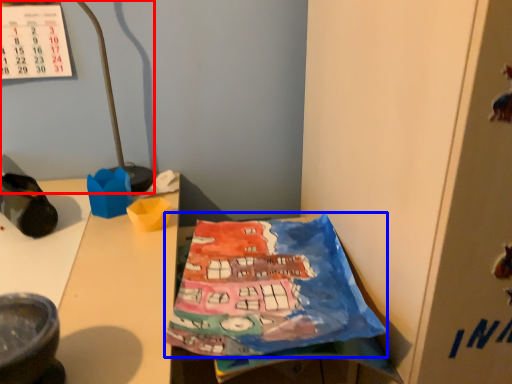
Question: Which object is closer to the camera taking this photo, lamp (highlighted by a red box) or wrapping paper (highlighted by a blue box)?

Choices:
 (A) lamp
 (B) wrapping paper

Answer: (B)